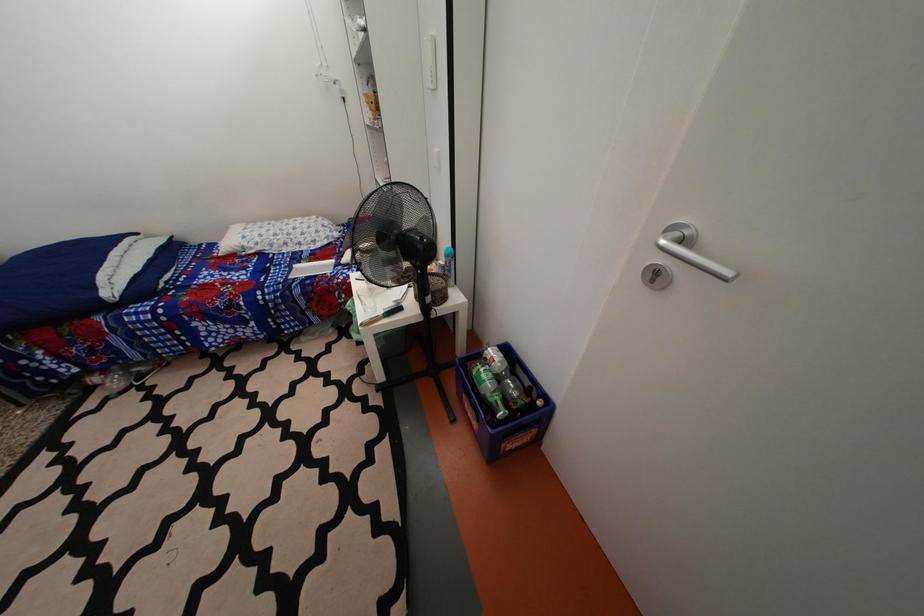
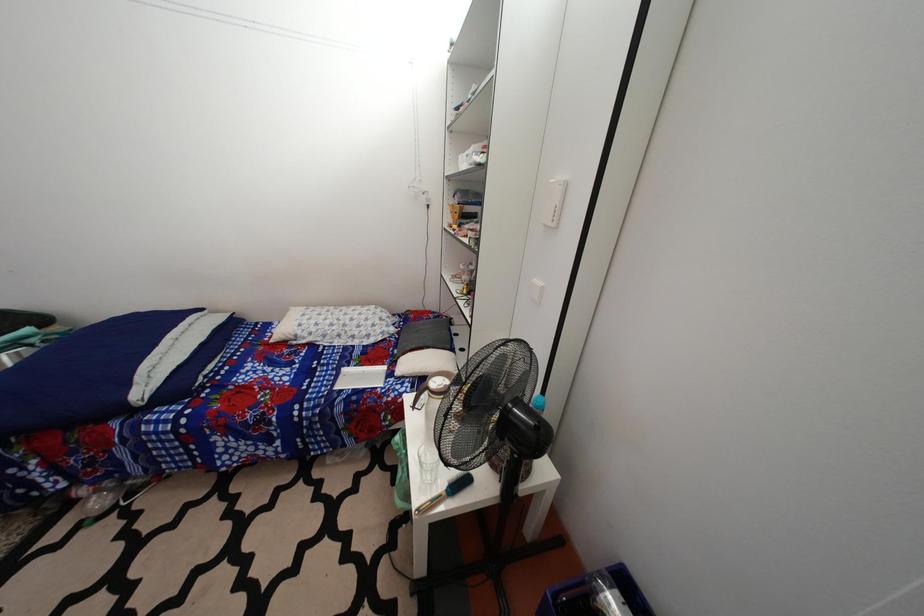
In a continuous first-person perspective shot, in which direction is the camera moving?

The cameraman walked toward left, forward.